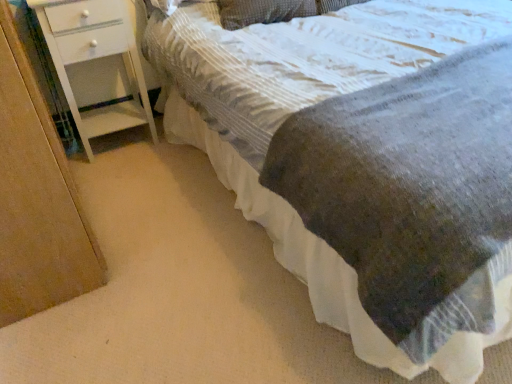
I want to click on textured gray blanket at center, so click(312, 104).

Could textured gray blanket at center be considered to be inside white painted wood chest of drawers at left?

No, textured gray blanket at center is not inside white painted wood chest of drawers at left.

Can you confirm if white painted wood chest of drawers at left is wider than textured gray blanket at center?

No, white painted wood chest of drawers at left is not wider than textured gray blanket at center.

The image size is (512, 384). Find the location of `bed located above the white painted wood chest of drawers at left (from a real-world perspective)`. bed located above the white painted wood chest of drawers at left (from a real-world perspective) is located at coordinates (312, 104).

From the image's perspective, is white painted wood chest of drawers at left beneath textured gray blanket at center?

No.

From the picture: Is textured gray pillow at upper center oriented away from textured gray blanket at center?

Yes, textured gray pillow at upper center is positioned with its back facing textured gray blanket at center.

Can you see textured gray pillow at upper center touching textured gray blanket at center?

No, textured gray pillow at upper center is not next to textured gray blanket at center.

From a real-world perspective, is textured gray pillow at upper center physically below textured gray blanket at center?

Actually, textured gray pillow at upper center is physically above textured gray blanket at center in the real world.

Does point (297, 3) come farther from viewer compared to point (99, 57)?

No, it is not.

Based on the photo, which object is more forward, textured gray pillow at upper center or white painted wood chest of drawers at left?

white painted wood chest of drawers at left is in front.

Is white painted wood chest of drawers at left at the back of textured gray pillow at upper center?

No.

Is white painted wood chest of drawers at left in contact with textured gray pillow at upper center?

No, white painted wood chest of drawers at left is not next to textured gray pillow at upper center.

Between point (77, 22) and point (220, 6), which one is positioned in front?

Positioned in front is point (77, 22).

From the image's perspective, which is above, white painted wood chest of drawers at left or textured gray pillow at upper center?

textured gray pillow at upper center, from the image's perspective.

Is white painted wood chest of drawers at left bigger than textured gray pillow at upper center?

Yes, white painted wood chest of drawers at left is bigger than textured gray pillow at upper center.

Are textured gray blanket at center and textured gray pillow at upper center located far from each other?

textured gray blanket at center is near textured gray pillow at upper center, not far away.

From the image's perspective, between textured gray blanket at center and textured gray pillow at upper center, who is located below?

textured gray blanket at center is shown below in the image.

Is textured gray blanket at center to the right of textured gray pillow at upper center from the viewer's perspective?

Indeed, textured gray blanket at center is positioned on the right side of textured gray pillow at upper center.

Which object is further away from the camera taking this photo, textured gray blanket at center or white painted wood chest of drawers at left?

white painted wood chest of drawers at left.

Is white painted wood chest of drawers at left at the back of textured gray blanket at center?

No, textured gray blanket at center is not facing the opposite direction of white painted wood chest of drawers at left.

Is textured gray blanket at center spatially inside white painted wood chest of drawers at left, or outside of it?

textured gray blanket at center exists outside the volume of white painted wood chest of drawers at left.

Are textured gray blanket at center and white painted wood chest of drawers at left far apart?

No, textured gray blanket at center is not far away from white painted wood chest of drawers at left.

Image resolution: width=512 pixels, height=384 pixels. I want to click on bed below the white painted wood chest of drawers at left (from the image's perspective), so click(312, 104).

Where is `pillow located behind the textured gray blanket at center`? Image resolution: width=512 pixels, height=384 pixels. pillow located behind the textured gray blanket at center is located at coordinates (263, 11).

Considering their positions, is textured gray blanket at center positioned further to white painted wood chest of drawers at left than textured gray pillow at upper center?

Among the two, textured gray blanket at center is located further to white painted wood chest of drawers at left.

Considering their positions, is white painted wood chest of drawers at left positioned further to textured gray pillow at upper center than textured gray blanket at center?

The object further to textured gray pillow at upper center is white painted wood chest of drawers at left.

Considering their positions, is textured gray pillow at upper center positioned further to white painted wood chest of drawers at left than textured gray blanket at center?

textured gray blanket at center lies further to white painted wood chest of drawers at left than the other object.

Estimate the real-world distances between objects in this image. Which object is further from textured gray blanket at center, textured gray pillow at upper center or white painted wood chest of drawers at left?

Based on the image, white painted wood chest of drawers at left appears to be further to textured gray blanket at center.

Based on their spatial positions, is textured gray blanket at center or white painted wood chest of drawers at left further from textured gray pillow at upper center?

Among the two, white painted wood chest of drawers at left is located further to textured gray pillow at upper center.

Based on their spatial positions, is white painted wood chest of drawers at left or textured gray pillow at upper center further from textured gray blanket at center?

white painted wood chest of drawers at left is positioned further to the anchor textured gray blanket at center.

Find the location of a particular element. The image size is (512, 384). the chest of drawers positioned between textured gray blanket at center and textured gray pillow at upper center from near to far is located at coordinates (94, 59).